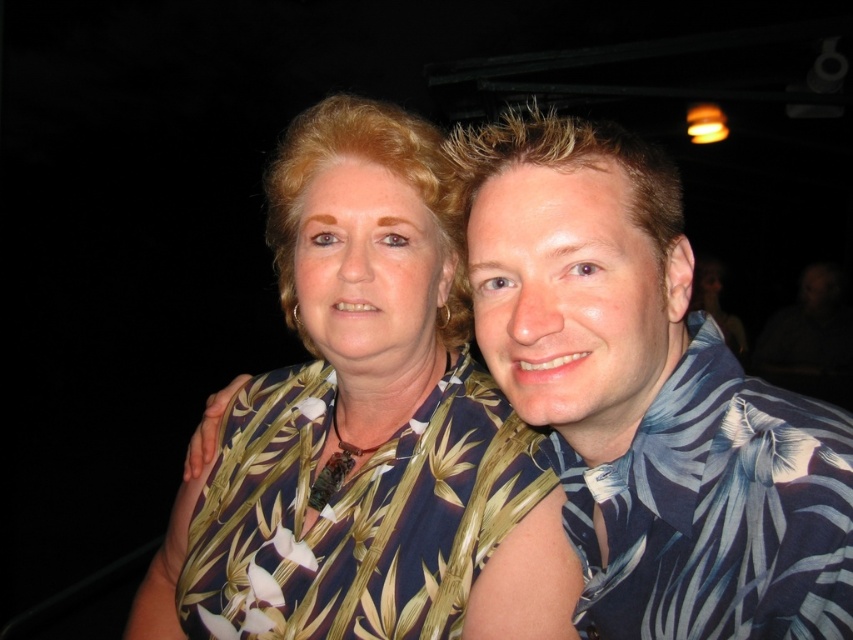
You are a photographer trying to adjust the lighting for a photo shoot. You have a spotlight that can illuminate an area 8 inches wide. There are two subjects in the scene, the printed fabric blouse at center and the blue floral shirt at right. Will the spotlight cover both subjects if placed between them?

The distance between the printed fabric blouse at center and the blue floral shirt at right is 7.99 inches. Since the spotlight can illuminate an area of 8 inches, it will cover both subjects when placed between them.

You are a photographer adjusting the lighting for a photo shoot. You notice two subjects wearing blue floral shirts. The one at the right and the one at the center. Since the background is dark, you want to ensure both shirts are equally visible. Given that the blue floral shirt at right is larger in size than the blue floral shirt at center, which shirt might need more light adjustment to ensure visibility?

The blue floral shirt at center might need more light adjustment because it is smaller in size compared to the blue floral shirt at right, so it might not capture as much light and could appear less visible in the dark background.

You are a photographer setting up for a group photo. You have two people wearing blue floral shirts. The person in the blue floral shirt at right and the person in the blue floral shirt at center. You need to arrange them so that the shorter person stands in front to avoid blocking the view. Which person should be placed in front?

The blue floral shirt at center should be placed in front because the blue floral shirt at right is taller, so the shorter person in the blue floral shirt at center will not block the view.